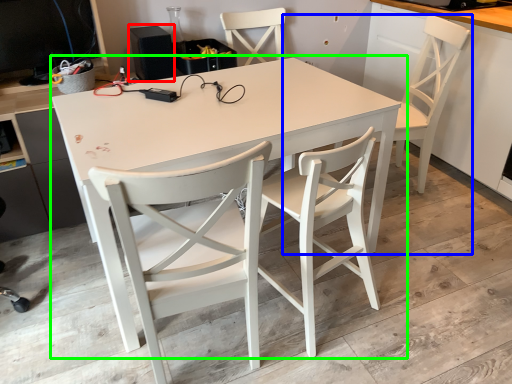
Question: Based on their relative distances, which object is nearer to speaker (highlighted by a red box)? Choose from chair (highlighted by a blue box) and table (highlighted by a green box).

Choices:
 (A) chair
 (B) table

Answer: (B)